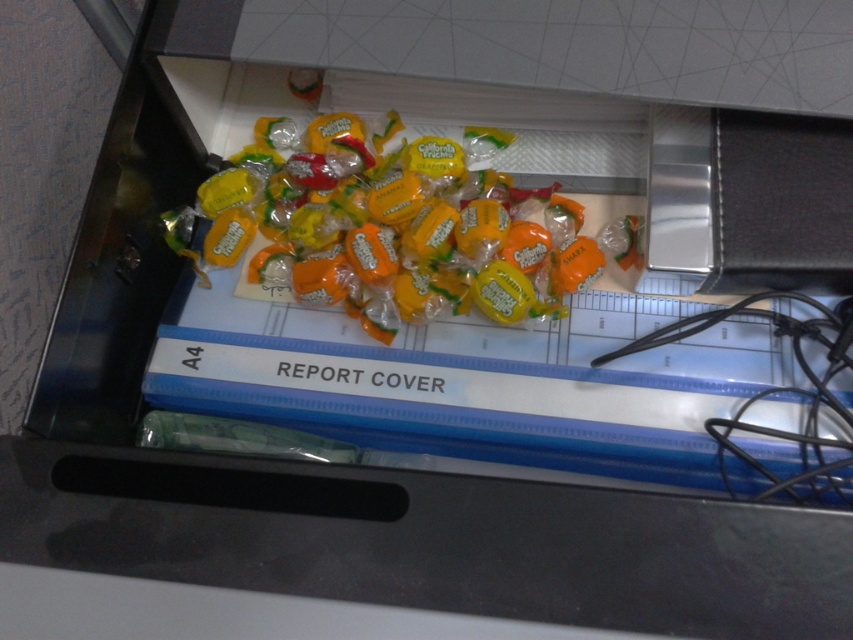
Can you confirm if yellow matte candy at center is positioned above black rubber wire at right?

Yes.

How distant is yellow matte candy at center from black rubber wire at right?

yellow matte candy at center and black rubber wire at right are 9.31 inches apart from each other.

Image resolution: width=853 pixels, height=640 pixels. Find the location of `yellow matte candy at center`. yellow matte candy at center is located at coordinates tap(401, 230).

The width and height of the screenshot is (853, 640). In order to click on yellow matte candy at center in this screenshot , I will do `click(401, 230)`.